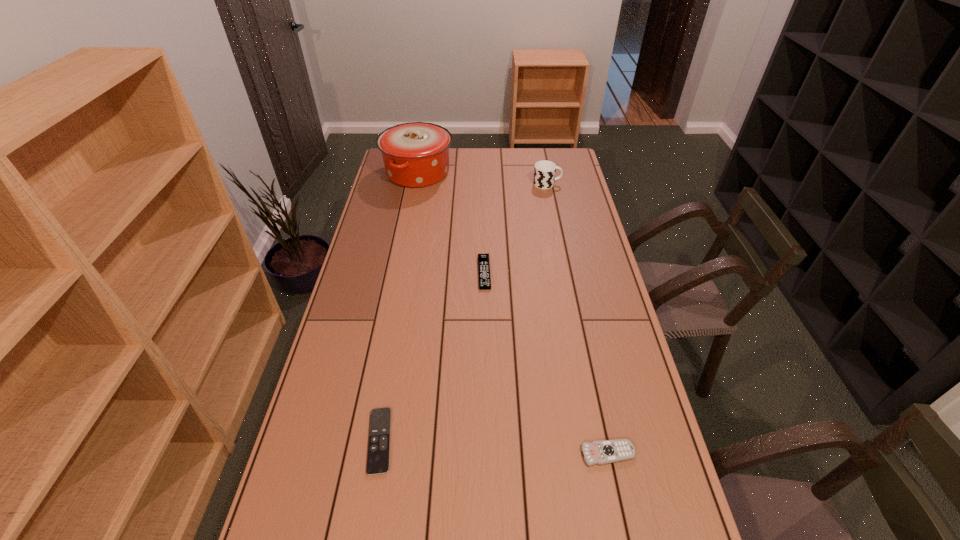
Image resolution: width=960 pixels, height=540 pixels. What are the coordinates of `vacant space situated 0.060m on the front of the leftmost remote control` in the screenshot? It's located at (369, 502).

Locate an element on the screen. The image size is (960, 540). object that is at the far edge is located at coordinates (416, 154).

Find the location of a particular element. The width and height of the screenshot is (960, 540). casserole located in the left edge section of the desktop is located at coordinates (416, 154).

I want to click on remote control located at the left edge, so click(378, 454).

This screenshot has height=540, width=960. I want to click on cup present at the right edge, so click(544, 173).

Locate an element on the screen. The image size is (960, 540). remote control that is at the right edge is located at coordinates (607, 451).

At what (x,y) coordinates should I click in order to perform the action: click on object that is positioned at the far left corner. Please return your answer as a coordinate pair (x, y). Looking at the image, I should click on (416, 154).

The width and height of the screenshot is (960, 540). In order to click on vacant space at the far edge of the desktop in this screenshot , I will do `click(470, 168)`.

In the image, there is a desktop. Where is `vacant space at the left edge`? The width and height of the screenshot is (960, 540). vacant space at the left edge is located at coordinates (369, 421).

I want to click on vacant space at the right edge, so click(x=574, y=204).